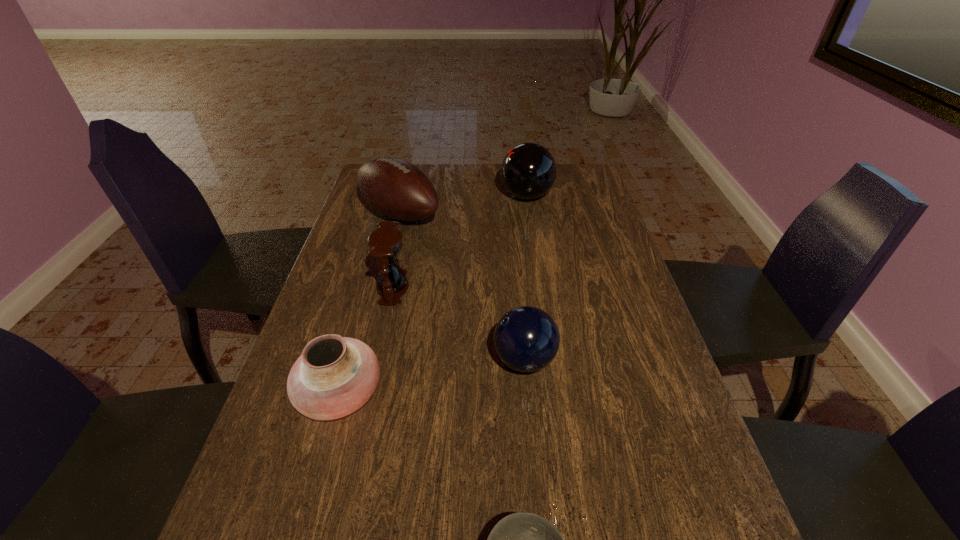
Find the location of a particular element. The height and width of the screenshot is (540, 960). the farther bowling ball is located at coordinates (528, 171).

Image resolution: width=960 pixels, height=540 pixels. Find the location of `football (American)`. football (American) is located at coordinates (395, 188).

This screenshot has height=540, width=960. Find the location of `hourglass`. hourglass is located at coordinates (385, 243).

This screenshot has height=540, width=960. In order to click on the shorter bowling ball in this screenshot , I will do `click(526, 338)`.

Locate an element on the screen. Image resolution: width=960 pixels, height=540 pixels. pottery is located at coordinates (334, 376).

Where is `blank area located on the surface of the farther bowling ball near the finger holes`? blank area located on the surface of the farther bowling ball near the finger holes is located at coordinates (420, 196).

At what (x,y) coordinates should I click in order to perform the action: click on free location located 0.090m on the surface of the farther bowling ball near the finger holes. Please return your answer as a coordinate pair (x, y). The height and width of the screenshot is (540, 960). Looking at the image, I should click on (474, 196).

Image resolution: width=960 pixels, height=540 pixels. I want to click on free space located on the surface of the farther bowling ball near the finger holes, so click(461, 196).

Image resolution: width=960 pixels, height=540 pixels. Identify the location of free space located on the front of the football (American). (391, 252).

Locate an element on the screen. The height and width of the screenshot is (540, 960). free space located 0.140m on the front of the hourglass is located at coordinates (380, 349).